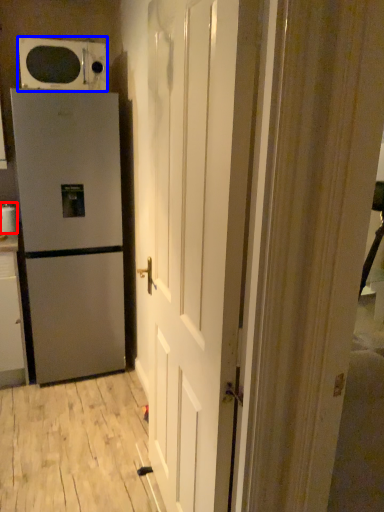
Question: Which object is further to the camera taking this photo, appliance (highlighted by a red box) or microwave oven (highlighted by a blue box)?

Choices:
 (A) appliance
 (B) microwave oven

Answer: (A)